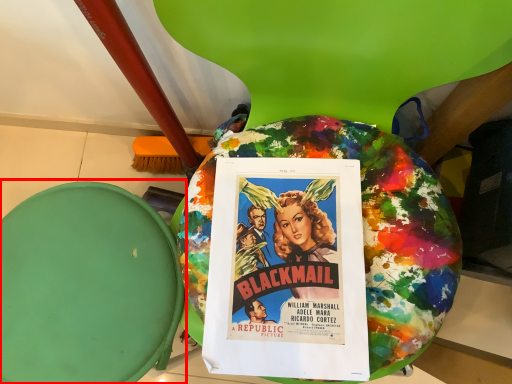
Question: From the image's perspective, considering the relative positions of bean bag chair (annotated by the red box) and poster in the image provided, where is bean bag chair (annotated by the red box) located with respect to the staircase?

Choices:
 (A) below
 (B) above

Answer: (A)